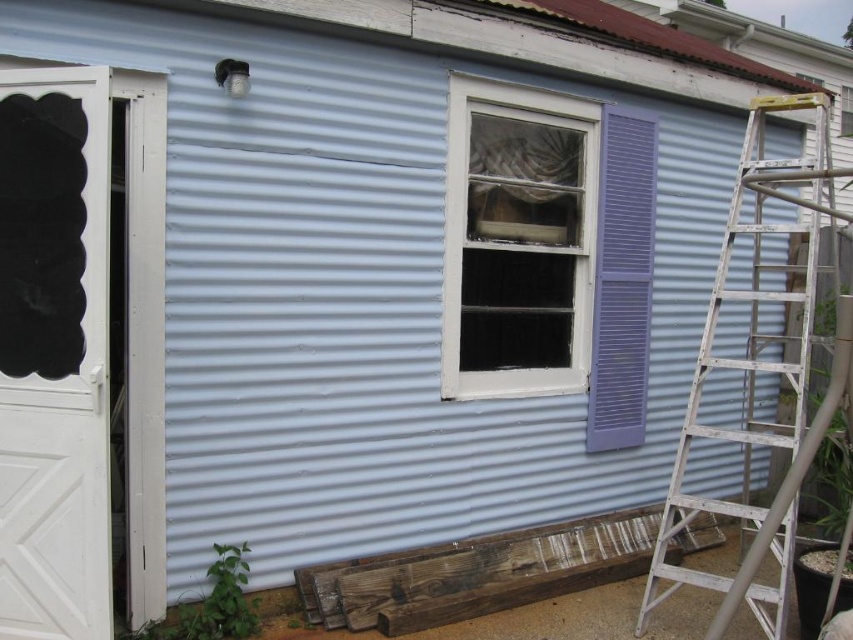
Question: Among these points, which one is nearest to the camera?

Choices:
 (A) (648, 568)
 (B) (457, 314)

Answer: (B)

Question: Does white wood window at center have a smaller size compared to white aluminum ladder at right?

Choices:
 (A) no
 (B) yes

Answer: (B)

Question: Is white matte door at left positioned behind white aluminum ladder at right?

Choices:
 (A) yes
 (B) no

Answer: (B)

Question: Based on their relative distances, which object is nearer to the white matte door at left?

Choices:
 (A) white wood window at center
 (B) white aluminum ladder at right

Answer: (A)

Question: Estimate the real-world distances between objects in this image. Which object is farther from the white wood window at center?

Choices:
 (A) white aluminum ladder at right
 (B) white matte door at left

Answer: (B)

Question: Is white wood window at center positioned before white aluminum ladder at right?

Choices:
 (A) yes
 (B) no

Answer: (B)